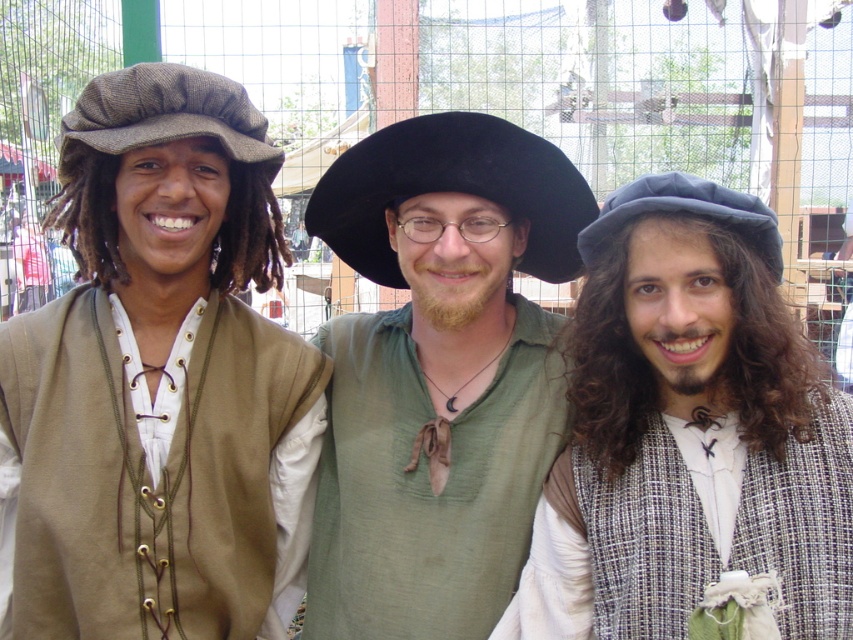
You are an artist sketching the scene from the image. You want to draw the black felt hat at center accurately. What are its coordinates?

The black felt hat at center is located at coordinates (451, 189).

What is the color of the vest at the point with coordinates (438, 372)?

The point at coordinates (438, 372) is located on a matte green vest at center.

You are at a festival and need to find the black felt hat at center. Which direction should you look relative to the brown woolen cap at left?

The black felt hat at center is located below the brown woolen cap at left, so you should look downward from the brown woolen cap at left to find it.